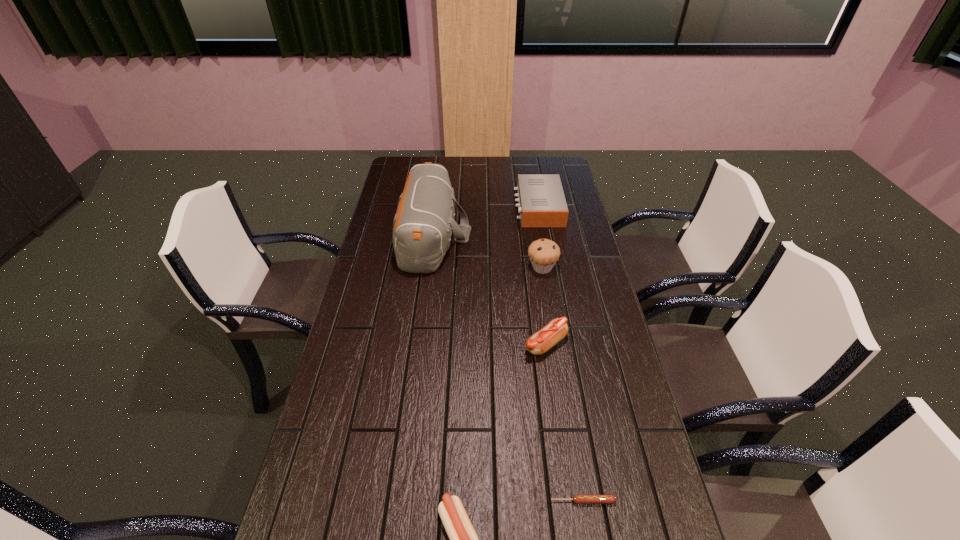
Identify the location of vacant point located between the second tallest object and the tallest object. The image size is (960, 540). (488, 251).

At what (x,y) coordinates should I click in order to perform the action: click on free space between the muffin and the tallest sausage. Please return your answer as a coordinate pair (x, y). The width and height of the screenshot is (960, 540). Looking at the image, I should click on (544, 306).

Locate an element on the screen. The image size is (960, 540). unoccupied position between the radio receiver and the second tallest object is located at coordinates (540, 237).

This screenshot has height=540, width=960. Identify the location of vacant space that's between the radio receiver and the fourth farthest object. click(542, 275).

I want to click on vacant space in between the radio receiver and the second tallest object, so click(540, 237).

Image resolution: width=960 pixels, height=540 pixels. I want to click on blank region between the duffel bag and the fourth farthest object, so click(x=490, y=289).

This screenshot has height=540, width=960. Find the location of `free spot between the fifth shortest object and the tallest object`. free spot between the fifth shortest object and the tallest object is located at coordinates (488, 251).

Locate which object ranks second in proximity to the shortest sausage. Please provide its 2D coordinates. Your answer should be formatted as a tuple, i.e. [(x, y)], where the tuple contains the x and y coordinates of a point satisfying the conditions above.

[(555, 330)]

Locate an element on the screen. object that is the fifth closest one to the second tallest object is located at coordinates (463, 539).

The width and height of the screenshot is (960, 540). In order to click on sausage that is the second closest to the duffel bag in this screenshot , I will do `click(463, 539)`.